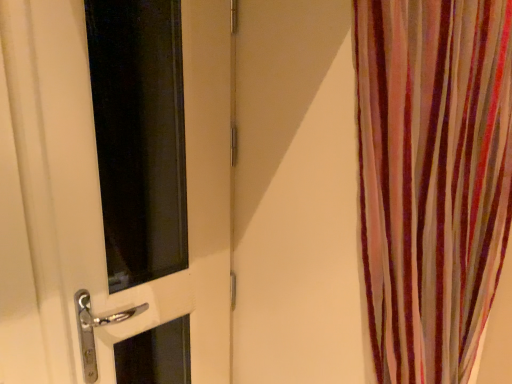
What is the approximate height of striped fabric curtain at right?

The height of striped fabric curtain at right is 29.54 inches.

Measure the distance between striped fabric curtain at right and camera.

The depth of striped fabric curtain at right is 16.05 inches.

Where is `striped fabric curtain at right`? striped fabric curtain at right is located at coordinates (432, 178).

The width and height of the screenshot is (512, 384). What do you see at coordinates (432, 178) in the screenshot?
I see `striped fabric curtain at right` at bounding box center [432, 178].

Describe the element at coordinates (115, 191) in the screenshot. The height and width of the screenshot is (384, 512). I see `white glossy door at left` at that location.

Find the location of a particular element. Image resolution: width=512 pixels, height=384 pixels. white glossy door at left is located at coordinates (115, 191).

The height and width of the screenshot is (384, 512). Identify the location of striped fabric curtain at right. (432, 178).

Does striped fabric curtain at right appear on the right side of white glossy door at left?

Yes.

Who is more distant, striped fabric curtain at right or white glossy door at left?

white glossy door at left.

Does point (445, 279) appear closer or farther from the camera than point (180, 31)?

Point (445, 279) is closer to the camera than point (180, 31).

From the image's perspective, does striped fabric curtain at right appear lower than white glossy door at left?

Yes.

From a real-world perspective, is striped fabric curtain at right below white glossy door at left?

No, from a real-world perspective, striped fabric curtain at right is not under white glossy door at left.

Between striped fabric curtain at right and white glossy door at left, which one has smaller width?

white glossy door at left.

Considering the sizes of striped fabric curtain at right and white glossy door at left in the image, is striped fabric curtain at right taller or shorter than white glossy door at left?

Clearly, striped fabric curtain at right is shorter compared to white glossy door at left.

Considering the sizes of objects striped fabric curtain at right and white glossy door at left in the image provided, who is bigger, striped fabric curtain at right or white glossy door at left?

striped fabric curtain at right is bigger.

Is striped fabric curtain at right surrounding white glossy door at left?

Definitely not — white glossy door at left is not inside striped fabric curtain at right.

Would you consider striped fabric curtain at right to be distant from white glossy door at left?

striped fabric curtain at right is near white glossy door at left, not far away.

Is striped fabric curtain at right facing away from white glossy door at left?

Yes, striped fabric curtain at right is facing away from white glossy door at left.

Where is `door on the left of striped fabric curtain at right`? door on the left of striped fabric curtain at right is located at coordinates (115, 191).

Which is more to the left, white glossy door at left or striped fabric curtain at right?

Positioned to the left is white glossy door at left.

Looking at this image, in the image, is white glossy door at left positioned in front of or behind striped fabric curtain at right?

Clearly, white glossy door at left is behind striped fabric curtain at right.

Considering the positions of point (185, 322) and point (384, 198), is point (185, 322) closer or farther from the camera than point (384, 198)?

Point (185, 322) is positioned farther from the camera compared to point (384, 198).

From the image's perspective, would you say white glossy door at left is positioned over striped fabric curtain at right?

Correct, white glossy door at left appears higher than striped fabric curtain at right in the image.

From a real-world perspective, is white glossy door at left physically located above or below striped fabric curtain at right?

From a real-world perspective, white glossy door at left is physically below striped fabric curtain at right.

Does white glossy door at left have a lesser width compared to striped fabric curtain at right?

Correct, the width of white glossy door at left is less than that of striped fabric curtain at right.

Which of these two, white glossy door at left or striped fabric curtain at right, stands shorter?

With less height is striped fabric curtain at right.

Considering the relative sizes of white glossy door at left and striped fabric curtain at right in the image provided, is white glossy door at left bigger than striped fabric curtain at right?

No, white glossy door at left is not bigger than striped fabric curtain at right.

Would you say striped fabric curtain at right is part of white glossy door at left's contents?

No, striped fabric curtain at right is not a part of white glossy door at left.

Based on the photo, is white glossy door at left in contact with striped fabric curtain at right?

No, white glossy door at left is not in contact with striped fabric curtain at right.

Is white glossy door at left facing away from striped fabric curtain at right?

white glossy door at left is not turned away from striped fabric curtain at right.

How different are the orientations of white glossy door at left and striped fabric curtain at right in degrees?

They differ by 0.856 degrees in their facing directions.

Locate an element on the screen. The height and width of the screenshot is (384, 512). curtain that appears in front of the white glossy door at left is located at coordinates (432, 178).

Locate an element on the screen. The height and width of the screenshot is (384, 512). door located above the striped fabric curtain at right (from the image's perspective) is located at coordinates (115, 191).

Where is `curtain in front of the white glossy door at left`? The image size is (512, 384). curtain in front of the white glossy door at left is located at coordinates (432, 178).